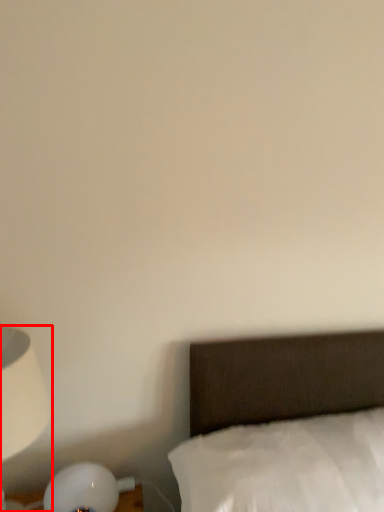
Question: Considering the relative positions of lamp (annotated by the red box) and bed in the image provided, where is lamp (annotated by the red box) located with respect to the staircase?

Choices:
 (A) left
 (B) right

Answer: (A)